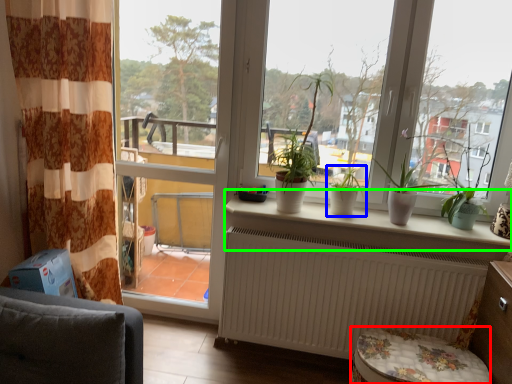
Question: Which object is positioned farthest from music stool (highlighted by a red box)? Select from houseplant (highlighted by a blue box) and window sill (highlighted by a green box).

Choices:
 (A) houseplant
 (B) window sill

Answer: (A)